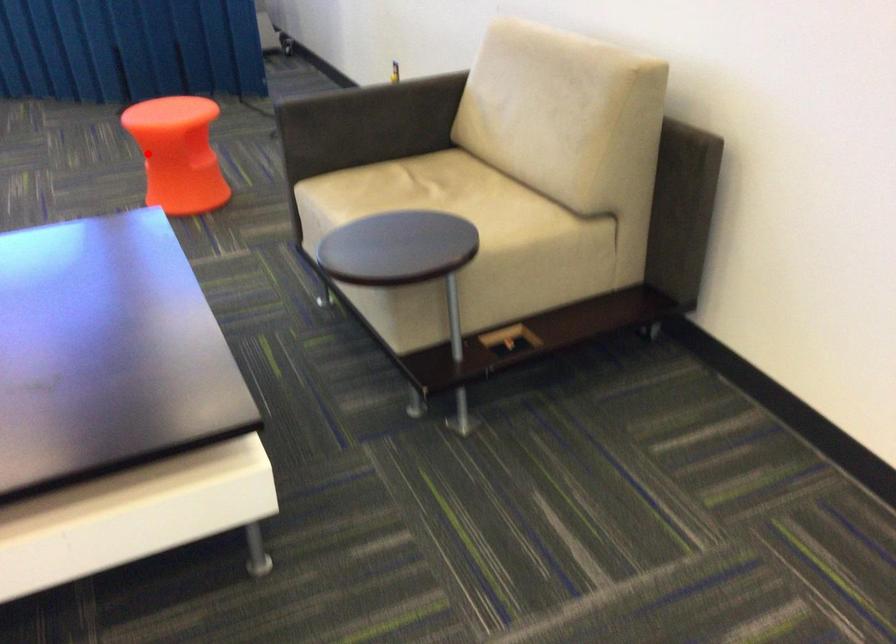
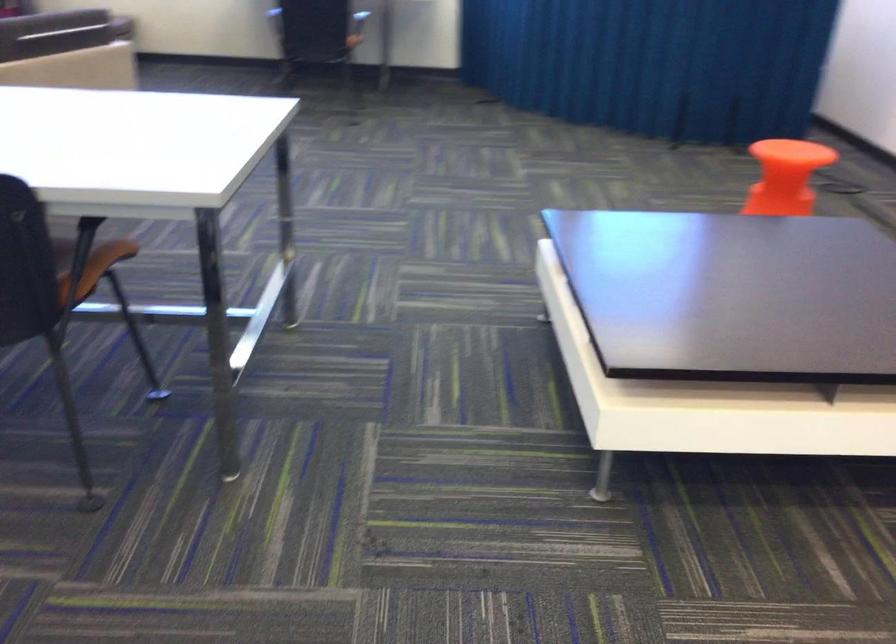
The point at the highlighted location is marked in the first image. Where is the corresponding point in the second image?

(785, 176)